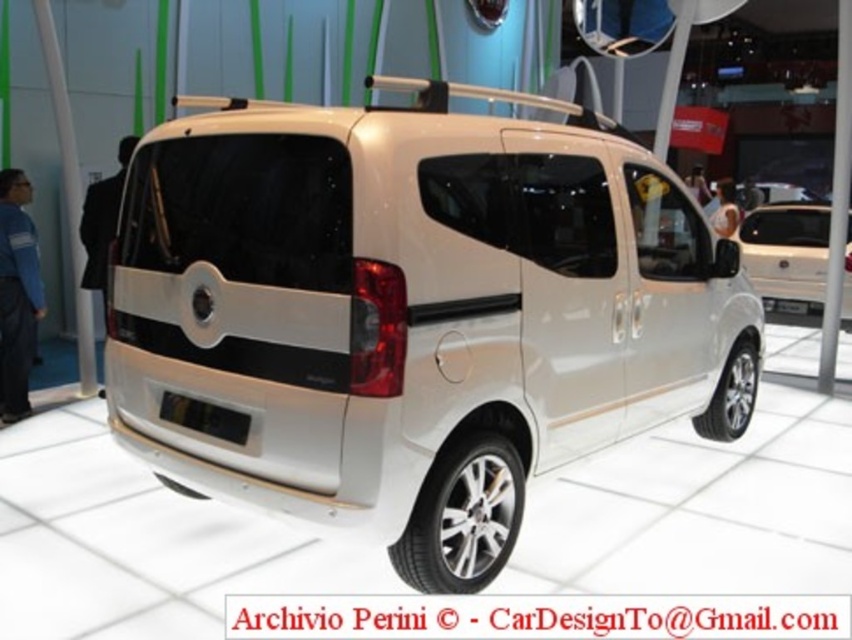
Who is more distant from viewer, (550, 124) or (770, 314)?

Point (770, 314)

Can you confirm if white metallic minivan at center is thinner than white matte van at center?

Incorrect, white metallic minivan at center's width is not less than white matte van at center's.

Does point (412, 458) lie behind point (816, 268)?

No, (412, 458) is closer to viewer.

Find the location of a particular element. This screenshot has height=640, width=852. white metallic minivan at center is located at coordinates (412, 314).